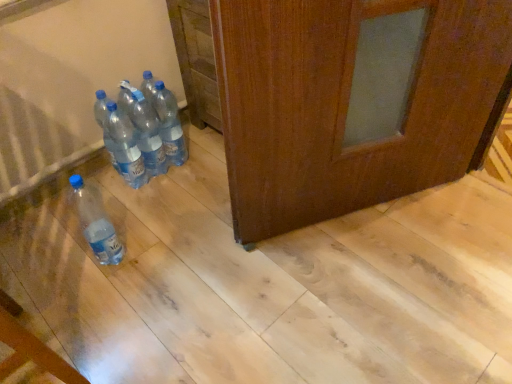
Locate an element on the screen. The width and height of the screenshot is (512, 384). vacant area located to the right-hand side of clear plastic bottles at center, the second bottle from the left is located at coordinates (181, 187).